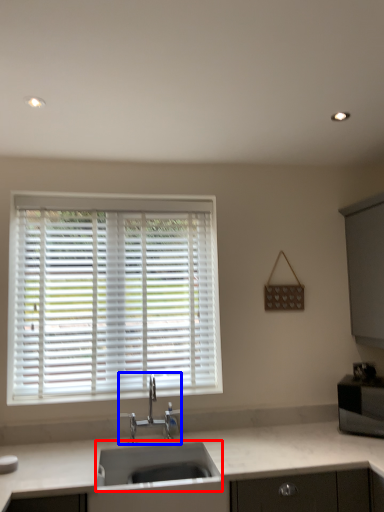
Question: Which of the following is the farthest to the observer, sink (highlighted by a red box) or tap (highlighted by a blue box)?

Choices:
 (A) sink
 (B) tap

Answer: (B)